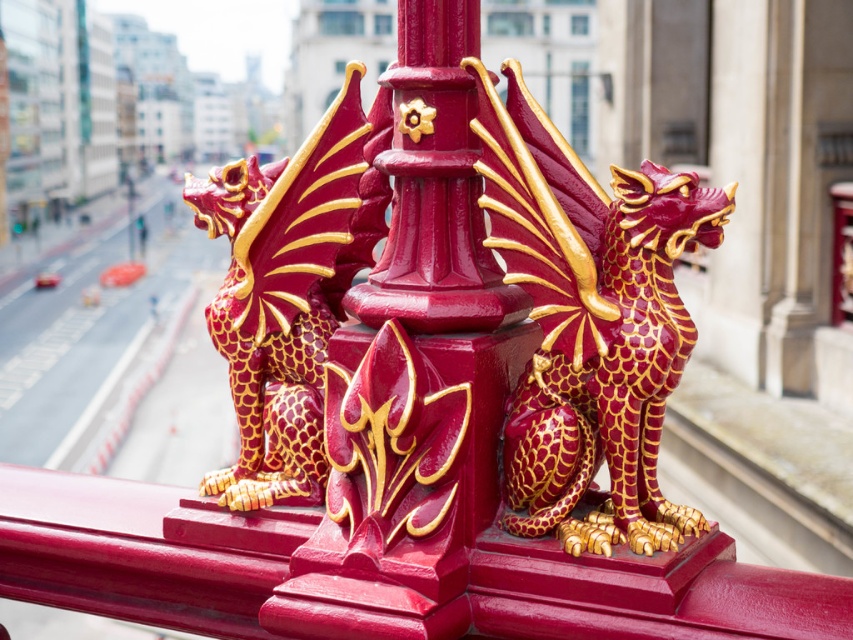
Where is `matte red and gold dragon at center`? This screenshot has height=640, width=853. matte red and gold dragon at center is located at coordinates (590, 323).

Does matte red and gold dragon at center lie behind matte gold/golden dragon at left?

That is False.

Is point (578, 337) farther from viewer compared to point (354, 186)?

No, (578, 337) is closer to viewer.

The width and height of the screenshot is (853, 640). I want to click on matte red and gold dragon at center, so click(590, 323).